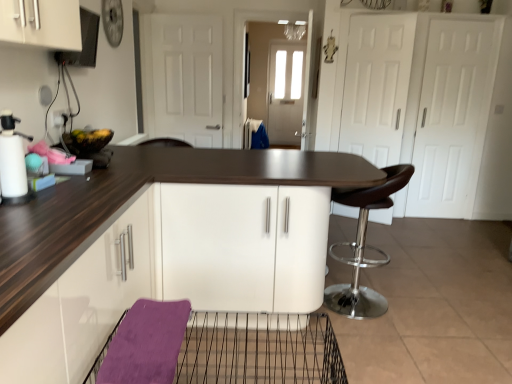
Describe the element at coordinates (13, 162) in the screenshot. I see `white matte spray bottle at left` at that location.

This screenshot has width=512, height=384. Identify the location of white matte door at center. [x=187, y=78].

Is white matte door at center bigger than wire mesh basket at lower center?

Indeed, white matte door at center has a larger size compared to wire mesh basket at lower center.

Is white matte door at center inside the boundaries of wire mesh basket at lower center, or outside?

white matte door at center is not enclosed by wire mesh basket at lower center.

From a real-world perspective, between white matte door at center and wire mesh basket at lower center, who is vertically lower?

wire mesh basket at lower center, from a real-world perspective.

In terms of height, does white matte door at center look taller or shorter compared to wire mesh basket at lower center?

Clearly, white matte door at center is taller compared to wire mesh basket at lower center.

In the image, is white matte door at center on the left side or the right side of white matte spray bottle at left?

From the image, it's evident that white matte door at center is to the right of white matte spray bottle at left.

Considering the relative sizes of white matte door at center and white matte spray bottle at left in the image provided, is white matte door at center shorter than white matte spray bottle at left?

Incorrect, the height of white matte door at center does not fall short of that of white matte spray bottle at left.

Is white matte door at center facing away from white matte spray bottle at left?

No, white matte door at center's orientation is not away from white matte spray bottle at left.

Considering the relative sizes of white matte door at center and white matte spray bottle at left in the image provided, is white matte door at center wider than white matte spray bottle at left?

Incorrect, the width of white matte door at center does not surpass that of white matte spray bottle at left.

Which of these two, white matte spray bottle at left or brown leather stool at right, is smaller?

white matte spray bottle at left.

Is white matte spray bottle at left taller or shorter than brown leather stool at right?

white matte spray bottle at left is shorter than brown leather stool at right.

Is white matte spray bottle at left turned away from brown leather stool at right?

No, white matte spray bottle at left's orientation is not away from brown leather stool at right.

Between white matte spray bottle at left and wire mesh basket at lower center, which one has larger size?

wire mesh basket at lower center is bigger.

Between point (5, 122) and point (237, 367), which one is positioned behind?

Positioned behind is point (237, 367).

From a real-world perspective, between white matte spray bottle at left and wire mesh basket at lower center, who is vertically lower?

wire mesh basket at lower center, from a real-world perspective.

This screenshot has height=384, width=512. I want to click on appliance on the left of wire mesh basket at lower center, so click(x=13, y=162).

Is wire mesh basket at lower center aimed at white matte spray bottle at left?

No, wire mesh basket at lower center is not oriented towards white matte spray bottle at left.

Is wire mesh basket at lower center at the right side of white matte spray bottle at left?

Yes.

Considering the sizes of objects wire mesh basket at lower center and white matte spray bottle at left in the image provided, who is shorter, wire mesh basket at lower center or white matte spray bottle at left?

Standing shorter between the two is wire mesh basket at lower center.

Which object is closer to the camera, wire mesh basket at lower center or white matte spray bottle at left?

wire mesh basket at lower center is more forward.

Is brown leather stool at right taller or shorter than white matte door at center?

brown leather stool at right is shorter than white matte door at center.

Considering the positions of point (326, 305) and point (179, 94), is point (326, 305) closer or farther from the camera than point (179, 94)?

Point (326, 305) is positioned closer to the camera compared to point (179, 94).

Is brown leather stool at right oriented towards white matte door at center?

No, brown leather stool at right is not aimed at white matte door at center.

Between brown leather stool at right and white matte door at center, which one has larger width?

Result: brown leather stool at right is wider.

Does point (341, 242) lie behind point (226, 375)?

Yes.

From the image's perspective, is brown leather stool at right below wire mesh basket at lower center?

No, from the image's perspective, brown leather stool at right is not beneath wire mesh basket at lower center.

From a real-world perspective, is brown leather stool at right located beneath wire mesh basket at lower center?

No, from a real-world perspective, brown leather stool at right is not below wire mesh basket at lower center.

Where is `door lying behind the wire mesh basket at lower center`? door lying behind the wire mesh basket at lower center is located at coordinates (187, 78).

Identify the location of appliance that appears in front of the white matte door at center. The width and height of the screenshot is (512, 384). tap(13, 162).

When comparing their distances from brown leather stool at right, does wire mesh basket at lower center or white matte door at center seem closer?

Based on the image, wire mesh basket at lower center appears to be nearer to brown leather stool at right.

Estimate the real-world distances between objects in this image. Which object is closer to wire mesh basket at lower center, white matte door at center or brown leather stool at right?

The object closer to wire mesh basket at lower center is brown leather stool at right.

Estimate the real-world distances between objects in this image. Which object is closer to white matte spray bottle at left, white matte door at center or brown leather stool at right?

Among the two, brown leather stool at right is located nearer to white matte spray bottle at left.

When comparing their distances from brown leather stool at right, does white matte door at center or wire mesh basket at lower center seem further?

white matte door at center is positioned further to the anchor brown leather stool at right.

Based on their spatial positions, is brown leather stool at right or white matte door at center closer to white matte spray bottle at left?

The object closer to white matte spray bottle at left is brown leather stool at right.

Based on their spatial positions, is white matte door at center or wire mesh basket at lower center further from white matte spray bottle at left?

white matte door at center lies further to white matte spray bottle at left than the other object.

Based on the photo, when comparing their distances from white matte spray bottle at left, does wire mesh basket at lower center or brown leather stool at right seem closer?

Among the two, wire mesh basket at lower center is located nearer to white matte spray bottle at left.

Estimate the real-world distances between objects in this image. Which object is closer to wire mesh basket at lower center, white matte spray bottle at left or brown leather stool at right?

brown leather stool at right is closer to wire mesh basket at lower center.

Find the location of a particular element. The height and width of the screenshot is (384, 512). chair between white matte spray bottle at left and white matte door at center along the z-axis is located at coordinates (364, 247).

Where is `cage between white matte spray bottle at left and brown leather stool at right in the horizontal direction`? This screenshot has width=512, height=384. cage between white matte spray bottle at left and brown leather stool at right in the horizontal direction is located at coordinates (230, 351).

Identify the location of appliance located between wire mesh basket at lower center and white matte door at center in the depth direction. Image resolution: width=512 pixels, height=384 pixels. tap(13, 162).

Where is `chair located between wire mesh basket at lower center and white matte door at center in the depth direction`? Image resolution: width=512 pixels, height=384 pixels. chair located between wire mesh basket at lower center and white matte door at center in the depth direction is located at coordinates (364, 247).